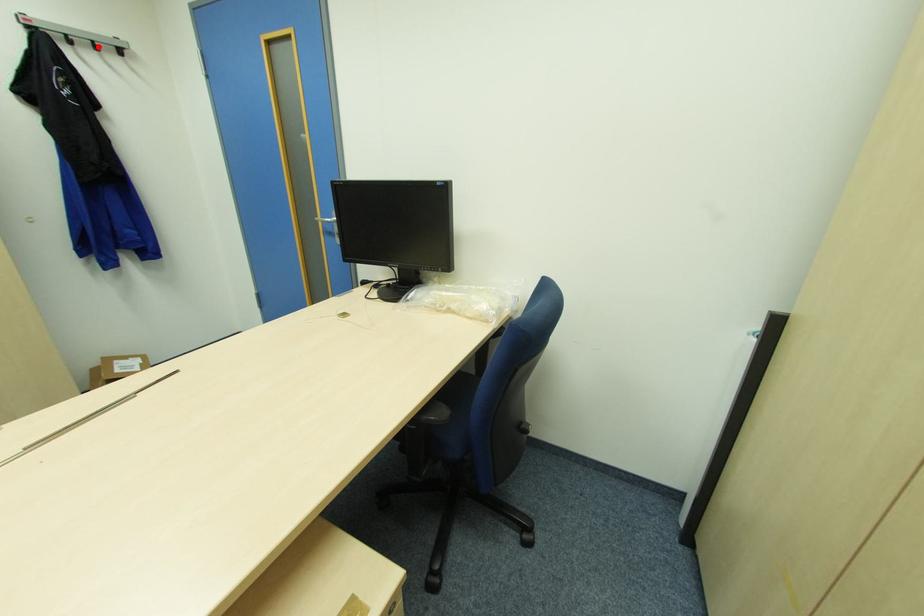
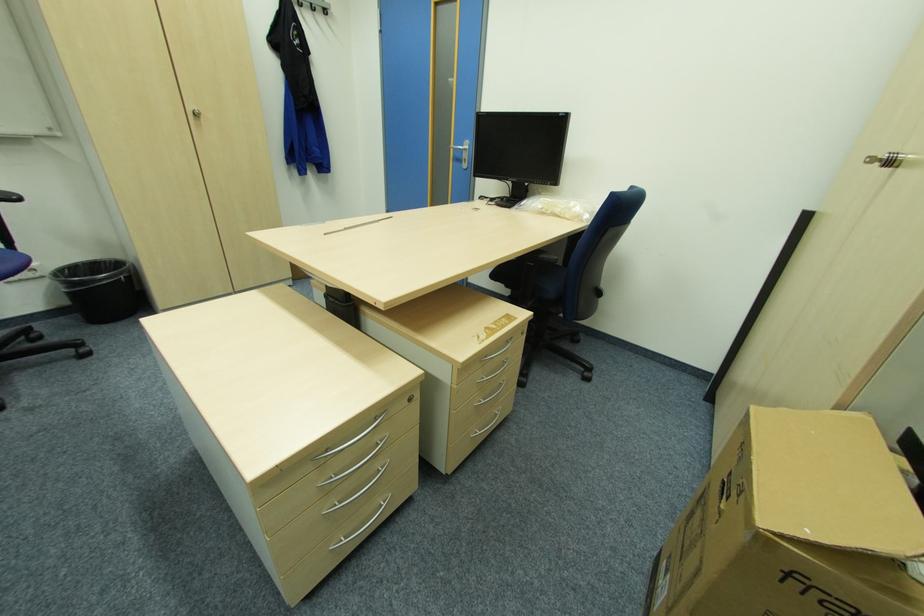
Locate, in the second image, the point that corresponds to the highlighted location in the first image.

(315, 7)